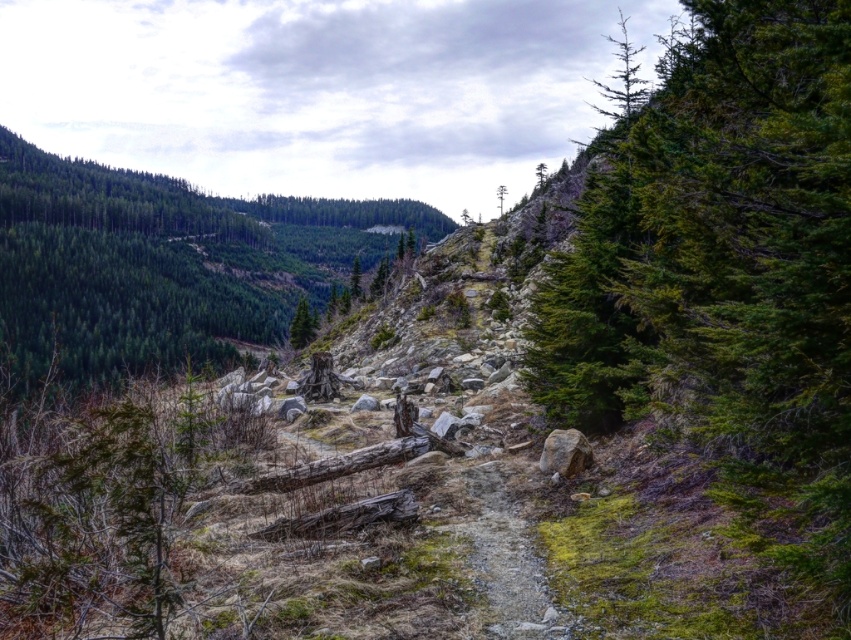
You are a hiker navigating the narrow dirt path in the mountainous forest. You notice two trees ahead of you. The green textured tree at right and the green matte tree at center. Which tree appears closer to you as you walk along the path?

The green textured tree at right appears closer because it is in front of the green matte tree at center from your perspective.

You are a hiker navigating a narrow mountain path. You come across two markers labeled point A and point B. According to the map, point A corresponds to point [249,230] and point B to [295,321]. Which point is closer to your current position if you are standing at the starting point of the path?

Point B is closer because point A is behind point B along the path.